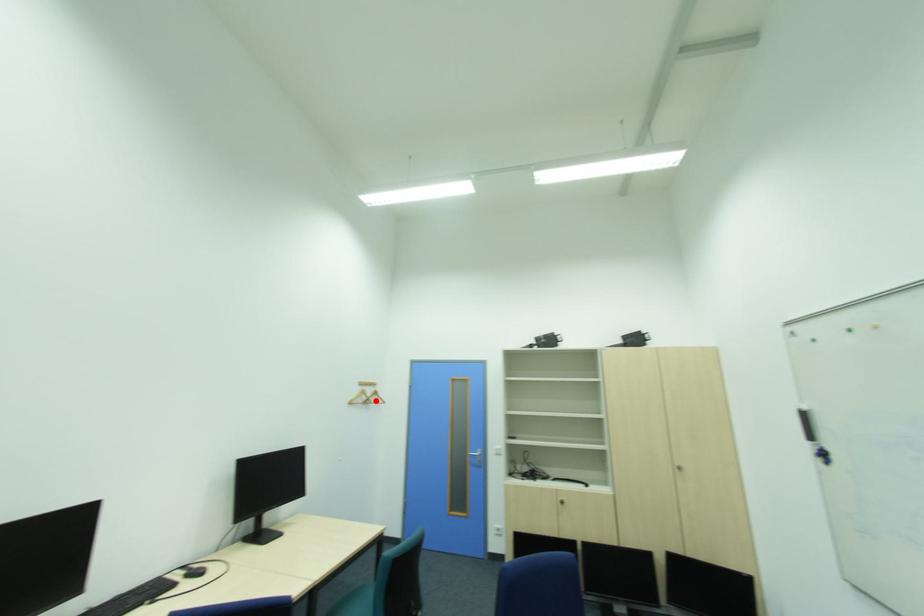
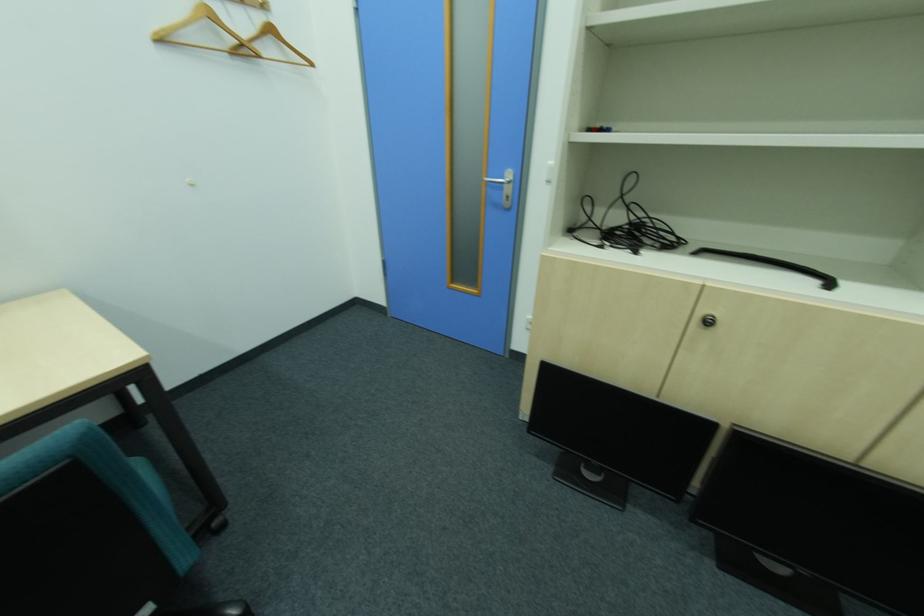
Find the pixel in the second image that matches the highlighted location in the first image.

(249, 45)